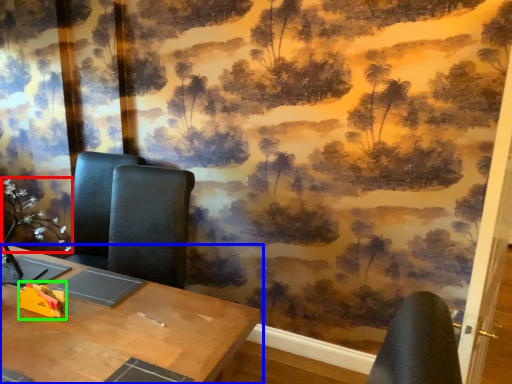
Question: Which object is the farthest from flower (highlighted by a red box)? Choose among these: table (highlighted by a blue box) or toy (highlighted by a green box).

Choices:
 (A) table
 (B) toy

Answer: (A)